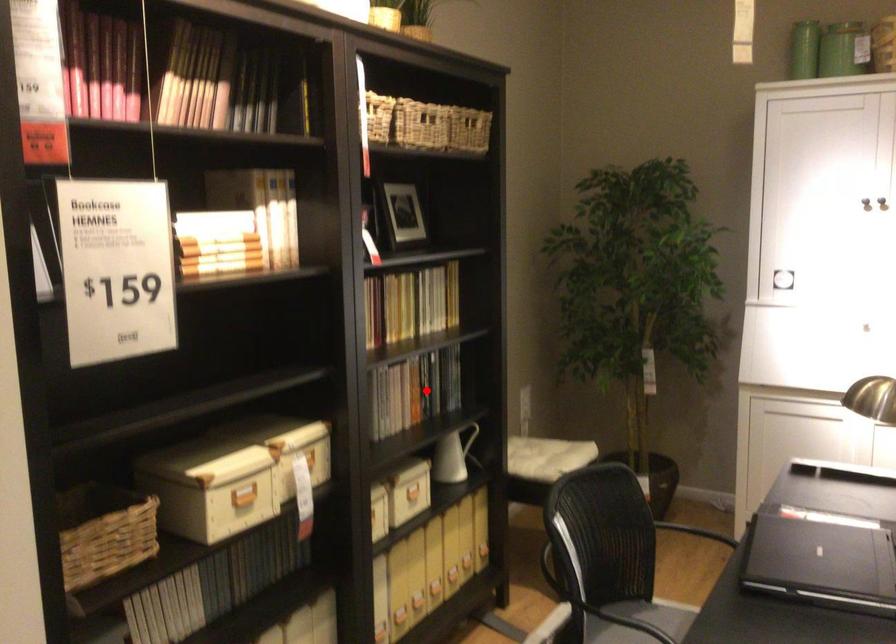
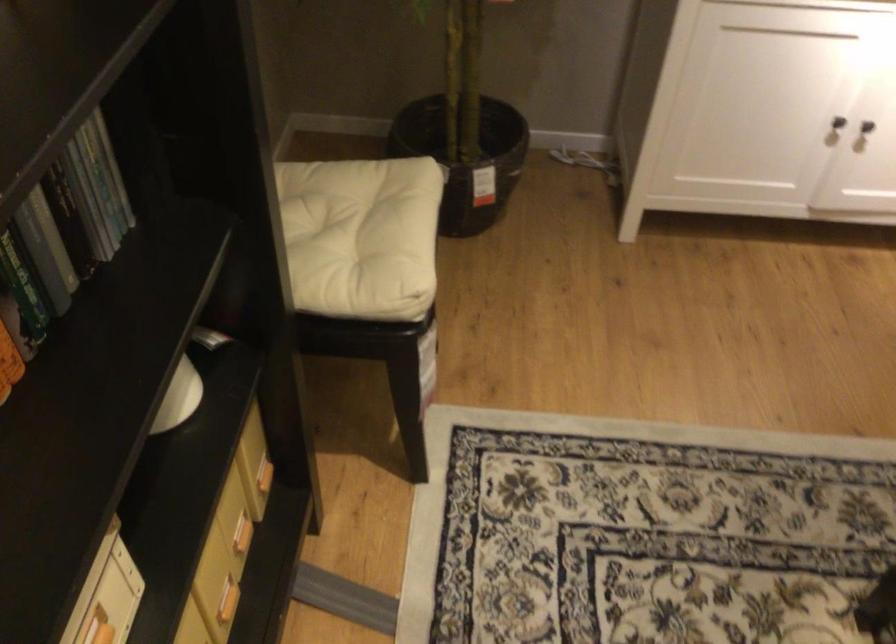
Question: A red point is marked in image1. In image2, is the corresponding 3D point closer to the camera or farther? Reply with the corresponding letter.

Choices:
 (A) The corresponding 3D point is closer.
 (B) The corresponding 3D point is farther.

Answer: (A)